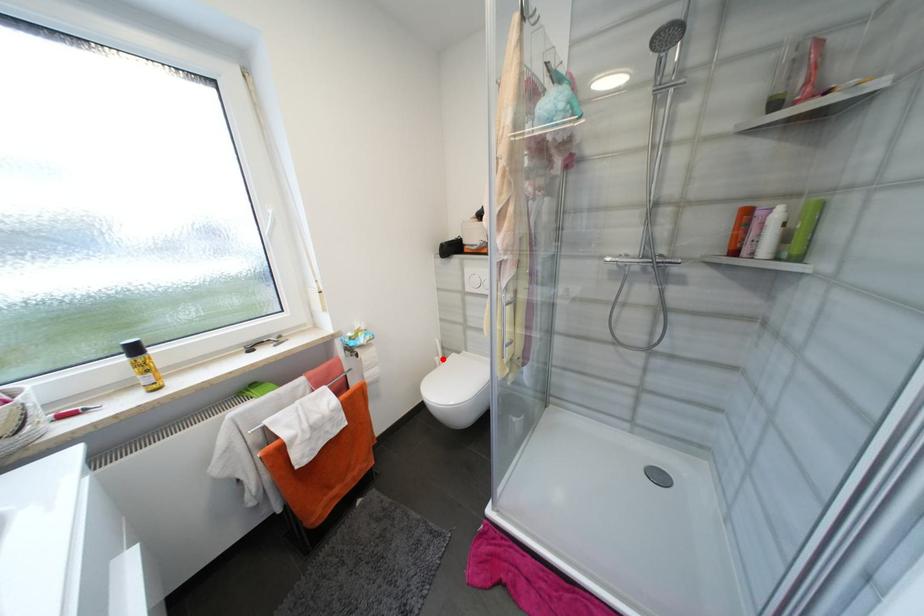
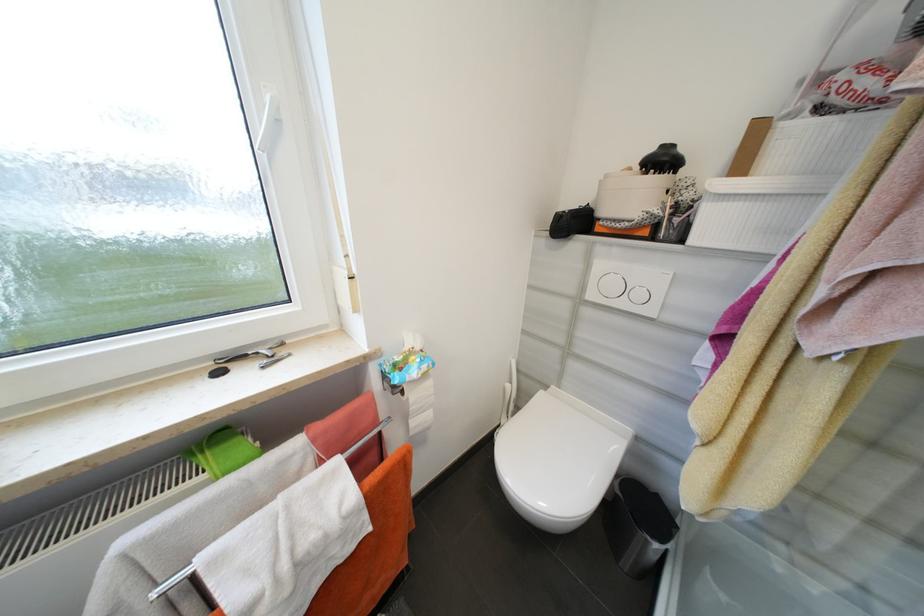
The point at the highlighted location is marked in the first image. Where is the corresponding point in the second image?

(514, 387)